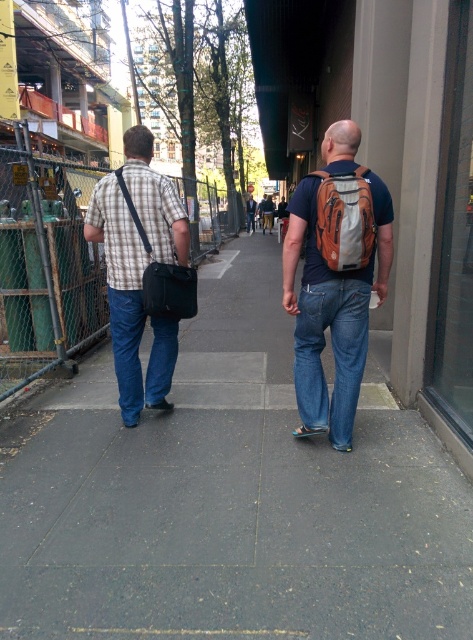
Question: Which point is closer to the camera taking this photo?

Choices:
 (A) (186, 308)
 (B) (330, 275)

Answer: (B)

Question: Does matte orange backpack at center have a smaller size compared to plaid fabric shirt at left?

Choices:
 (A) yes
 (B) no

Answer: (A)

Question: Which object is positioned farthest from the gray concrete sidewalk at center?

Choices:
 (A) matte black bag at left
 (B) blue denim jeans at left
 (C) blue denim jeans at center
 (D) matte orange backpack at center

Answer: (A)

Question: Is matte orange backpack at center positioned in front of orange fabric backpack at center?

Choices:
 (A) no
 (B) yes

Answer: (A)

Question: Can you confirm if matte orange backpack at center is positioned to the left of orange fabric backpack at center?

Choices:
 (A) no
 (B) yes

Answer: (B)

Question: Estimate the real-world distances between objects in this image. Which object is closer to the blue denim jeans at left?

Choices:
 (A) matte black bag at left
 (B) blue denim jeans at center
 (C) orange fabric backpack at center

Answer: (A)